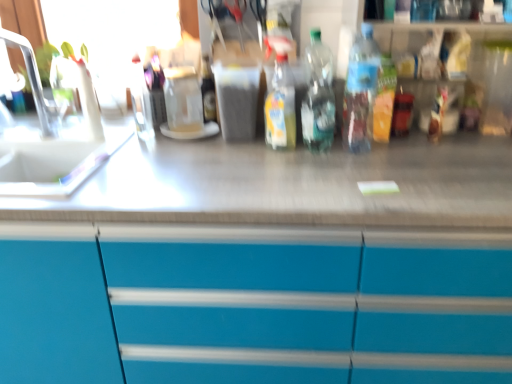
The width and height of the screenshot is (512, 384). Identify the location of free space to the left of transparent plastic bottle at center, positioned as the third bottle in left-to-right order. (257, 153).